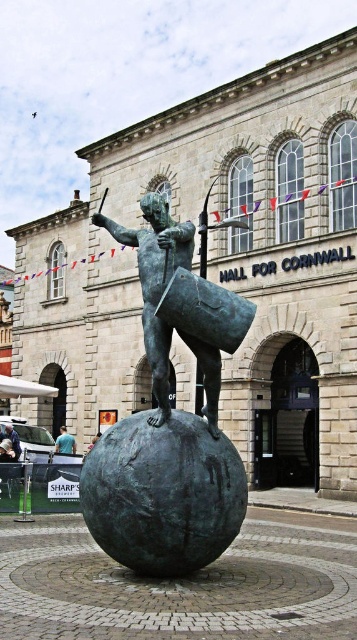
Question: Estimate the real-world distances between objects in this image. Which object is closer to the light blue jeans at lower left?

Choices:
 (A) light blue shirt at center
 (B) bronze statue at center

Answer: (A)

Question: Which point is closer to the camera taking this photo?

Choices:
 (A) (61, 448)
 (B) (4, 428)
 (C) (151, 512)

Answer: (C)

Question: Observing the image, what is the correct spatial positioning of bronze statue at center in reference to light blue shirt at center?

Choices:
 (A) above
 (B) below

Answer: (A)

Question: Estimate the real-world distances between objects in this image. Which object is farther from the light blue shirt at center?

Choices:
 (A) bronze statue at center
 (B) light blue jeans at lower left

Answer: (A)

Question: Is light blue shirt at center above light blue jeans at lower left?

Choices:
 (A) no
 (B) yes

Answer: (A)

Question: Can you confirm if light blue shirt at center is positioned to the right of light blue jeans at lower left?

Choices:
 (A) no
 (B) yes

Answer: (B)